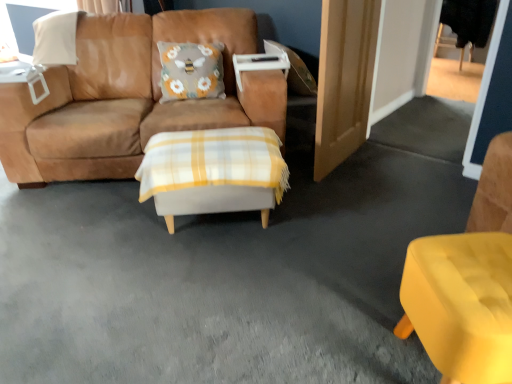
The image size is (512, 384). Find the location of `free space above white plaid ottoman at center, acting as the 1th table starting from the front (from a real-world perspective)`. free space above white plaid ottoman at center, acting as the 1th table starting from the front (from a real-world perspective) is located at coordinates (212, 145).